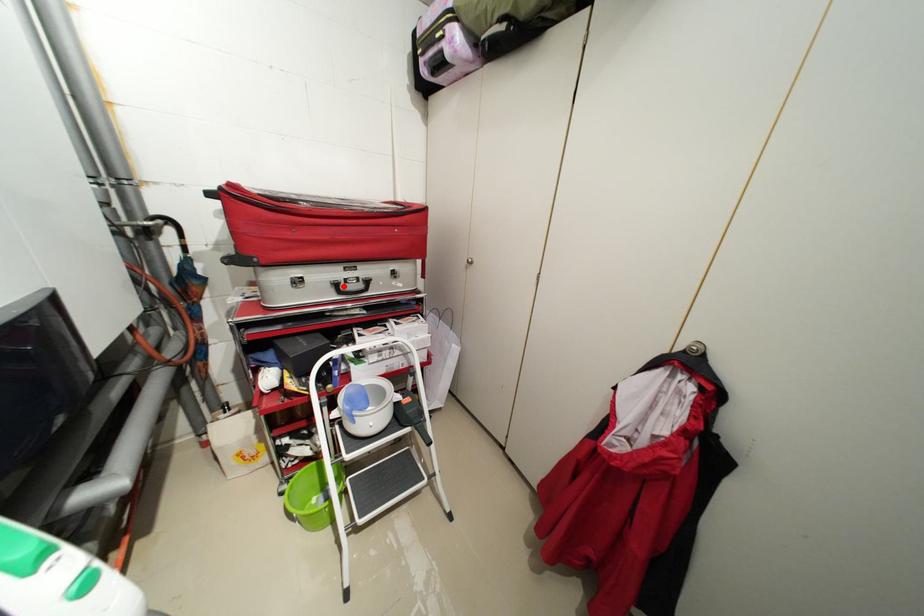
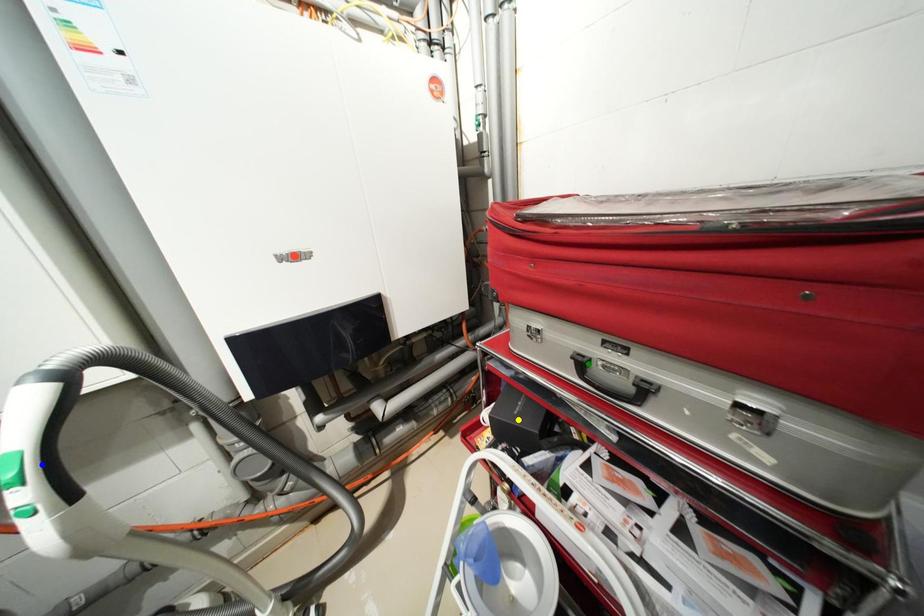
Question: I am providing you with two images of the same scene from different viewpoints. A red point is marked on the first image. You are given multiple points on the second image. Which point in image 2 is actually the same real-world point as the red point in image 1?

Choices:
 (A) blue point
 (B) yellow point
 (C) green point

Answer: (C)